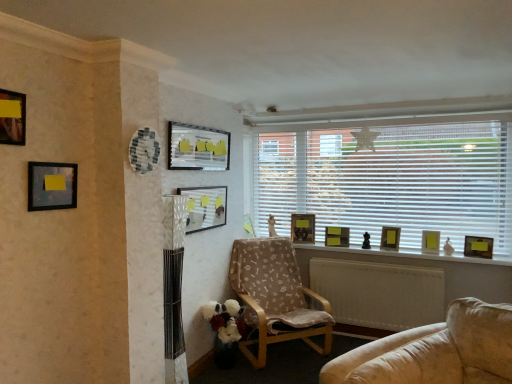
Image resolution: width=512 pixels, height=384 pixels. What are the coordinates of `yellow matte picture frame at right, the 6th picture frame from the front` in the screenshot? It's located at (430, 241).

How much space does yellow matte picture frame at right, positioned as the 8th picture frame in left-to-right order, occupy vertically?

9.43 inches.

In order to face wooden photo frame at center, which is the first picture frame in back-to-front order, should I rotate leftwards or rightwards?

You should look right and rotate roughly 6.570 degrees.

What do you see at coordinates (390, 237) in the screenshot? I see `yellow matte picture frame at window, which is the 7th picture frame in left-to-right order` at bounding box center [390, 237].

This screenshot has height=384, width=512. What are the coordinates of `matte black picture frame at upper center, which is the third picture frame from left to right` in the screenshot? It's located at (197, 148).

Where is `white blinds at upper right`? white blinds at upper right is located at coordinates (391, 179).

Which point is more forward, [42,172] or [341,229]?

The point [42,172] is closer.

Which is in front, matte black picture frame at upper left, the second picture frame positioned from the left, or matte black picture frame at center, the fourth picture frame when ordered from right to left?

matte black picture frame at upper left, the second picture frame positioned from the left, is closer to the camera.

Can you tell me how much matte black picture frame at upper left, which ranks as the 8th picture frame in back-to-front order, and matte black picture frame at center, the fourth picture frame when ordered from right to left, differ in facing direction?

They differ by 83.9 degrees in their facing directions.

Considering the positions of objects matte black picture frame at upper left, which ranks as the 8th picture frame in back-to-front order, and matte black picture frame at center, which appears as the sixth picture frame when viewed from the left, in the image provided, who is more to the left, matte black picture frame at upper left, which ranks as the 8th picture frame in back-to-front order, or matte black picture frame at center, which appears as the sixth picture frame when viewed from the left,?

matte black picture frame at upper left, which ranks as the 8th picture frame in back-to-front order.

Does wooden window sill at center have a greater height compared to matte black picture frame at center, which is the 8th picture frame in front-to-back order?

No, wooden window sill at center is not taller than matte black picture frame at center, which is the 8th picture frame in front-to-back order.

From the image's perspective, is wooden window sill at center on matte black picture frame at center, the fourth picture frame when ordered from right to left?

No, from the image's perspective, wooden window sill at center is not over matte black picture frame at center, the fourth picture frame when ordered from right to left.

Is the depth of wooden window sill at center greater than that of matte black picture frame at center, positioned as the second picture frame in back-to-front order?

That is False.

Can you tell me how much wooden window sill at center and matte black picture frame at center, the fourth picture frame when ordered from right to left, differ in facing direction?

They differ by 2.14 degrees in their facing directions.

You are a GUI agent. You are given a task and a screenshot of the screen. Output one action in this format:
    pyautogui.click(x=<x>, y=<y>)
    Task: Click on the picture frame below the yellow matte picture frame at right, positioned as the 8th picture frame in left-to-right order (from a real-world perspective)
    
    Given the screenshot: What is the action you would take?
    pyautogui.click(x=478, y=246)

In the scene shown: Considering the relative positions of yellow matte picture frame at right, positioned as the 8th picture frame in left-to-right order, and wooden picture frame at right, which is counted as the fifth picture frame, starting from the back, in the image provided, is yellow matte picture frame at right, positioned as the 8th picture frame in left-to-right order, in front of wooden picture frame at right, which is counted as the fifth picture frame, starting from the back,?

That is False.

How distant is yellow matte picture frame at right, marked as the second picture frame in a right-to-left arrangement, from wooden picture frame at right, arranged as the 1th picture frame when viewed from the right?

yellow matte picture frame at right, marked as the second picture frame in a right-to-left arrangement, is 11.91 inches from wooden picture frame at right, arranged as the 1th picture frame when viewed from the right.

Is white blinds at upper right far from yellow matte picture frame at window, acting as the 7th picture frame starting from the front?

No, white blinds at upper right is in close proximity to yellow matte picture frame at window, acting as the 7th picture frame starting from the front.

From the image's perspective, between white blinds at upper right and yellow matte picture frame at window, which is the 7th picture frame in left-to-right order, which one is located above?

white blinds at upper right appears higher in the image.

Is the depth of white blinds at upper right less than that of yellow matte picture frame at window, acting as the 7th picture frame starting from the front?

Yes.

From a real-world perspective, which is physically above, white blinds at upper right or yellow matte picture frame at window, placed as the 3th picture frame when sorted from right to left?

white blinds at upper right, from a real-world perspective.

From the image's perspective, which one is positioned higher, yellow matte picture frame at window, placed as the 3th picture frame when sorted from right to left, or wooden armchair at center?

yellow matte picture frame at window, placed as the 3th picture frame when sorted from right to left.

Does yellow matte picture frame at window, placed as the 3th picture frame when sorted from right to left, have a smaller size compared to wooden armchair at center?

Correct, yellow matte picture frame at window, placed as the 3th picture frame when sorted from right to left, occupies less space than wooden armchair at center.

Looking at this image, which is in front, yellow matte picture frame at window, acting as the 7th picture frame starting from the front, or wooden armchair at center?

wooden armchair at center is more forward.

Is yellow matte picture frame at window, which is the 7th picture frame in left-to-right order, facing away from wooden armchair at center?

No, wooden armchair at center is not at the back of yellow matte picture frame at window, which is the 7th picture frame in left-to-right order.

From their relative heights in the image, would you say matte glass picture frame at center, the 6th picture frame in the back-to-front sequence, is taller or shorter than matte black picture frame at upper left, placed as the 1th picture frame when sorted from left to right?

Considering their sizes, matte glass picture frame at center, the 6th picture frame in the back-to-front sequence, has more height than matte black picture frame at upper left, placed as the 1th picture frame when sorted from left to right.

Starting from the matte glass picture frame at center, the 4th picture frame viewed from the left, which picture frame is the 3rd one in front? Please provide its 2D coordinates.

[(12, 118)]

Is matte glass picture frame at center, the 6th picture frame in the back-to-front sequence, oriented away from matte black picture frame at upper left, marked as the ninth picture frame in a right-to-left arrangement?

No, matte glass picture frame at center, the 6th picture frame in the back-to-front sequence,'s orientation is not away from matte black picture frame at upper left, marked as the ninth picture frame in a right-to-left arrangement.

Does point (195, 215) appear closer or farther from the camera than point (16, 141)?

Clearly, point (195, 215) is more distant from the camera than point (16, 141).

Considering the points (38, 172) and (200, 187), which point is in front, point (38, 172) or point (200, 187)?

Point (38, 172)

Is matte black picture frame at upper left, which ranks as the 8th picture frame in back-to-front order, facing towards matte glass picture frame at center, the 4th picture frame viewed from the left?

No.

How different are the orientations of matte black picture frame at upper left, which ranks as the 8th picture frame in back-to-front order, and matte glass picture frame at center, the 4th picture frame viewed from the left, in degrees?

4.4 degrees.

From the picture: Is matte black picture frame at upper left, positioned as the second picture frame in front-to-back order, to the right of matte glass picture frame at center, arranged as the 4th picture frame when viewed from the front, from the viewer's perspective?

Incorrect, matte black picture frame at upper left, positioned as the second picture frame in front-to-back order, is not on the right side of matte glass picture frame at center, arranged as the 4th picture frame when viewed from the front.

From the image's perspective, count 4th picture frames downward from the matte black picture frame at upper left, the second picture frame positioned from the left, and point to it. Please provide its 2D coordinates.

[(337, 236)]

Identify the location of window sill in front of the matte black picture frame at center, which appears as the sixth picture frame when viewed from the left. (404, 254).

Which object lies further to the anchor point wooden window sill at center, yellow matte picture frame at window, acting as the 7th picture frame starting from the front, or wooden armchair at center?

wooden armchair at center.

From the image, which object appears to be farther from yellow matte picture frame at window, acting as the 7th picture frame starting from the front, matte black picture frame at upper left, placed as the ninth picture frame when sorted from back to front, or matte black picture frame at upper center, which is the third picture frame from left to right?

matte black picture frame at upper left, placed as the ninth picture frame when sorted from back to front, is positioned further to the anchor yellow matte picture frame at window, acting as the 7th picture frame starting from the front.

Which object lies nearer to the anchor point matte black picture frame at upper left, which ranks as the 8th picture frame in back-to-front order, wooden photo frame at center, which is the first picture frame in back-to-front order, or matte glass picture frame at center, arranged as the 4th picture frame when viewed from the front?

matte glass picture frame at center, arranged as the 4th picture frame when viewed from the front, lies closer to matte black picture frame at upper left, which ranks as the 8th picture frame in back-to-front order, than the other object.

When comparing their distances from wooden window sill at center, does matte black picture frame at upper left, placed as the 1th picture frame when sorted from left to right, or matte black picture frame at center, positioned as the second picture frame in back-to-front order, seem closer?

The object closer to wooden window sill at center is matte black picture frame at center, positioned as the second picture frame in back-to-front order.

From the image, which object appears to be farther from yellow matte picture frame at right, the 6th picture frame from the front, matte black picture frame at center, positioned as the second picture frame in back-to-front order, or matte glass picture frame at center, the 4th picture frame viewed from the left?

matte glass picture frame at center, the 4th picture frame viewed from the left.

From the picture: Considering their positions, is wooden picture frame at right, arranged as the 1th picture frame when viewed from the right, positioned further to yellow matte picture frame at window, acting as the 7th picture frame starting from the front, than wooden photo frame at center, which is the first picture frame in back-to-front order?

wooden photo frame at center, which is the first picture frame in back-to-front order, lies further to yellow matte picture frame at window, acting as the 7th picture frame starting from the front, than the other object.

When comparing their distances from matte black picture frame at upper left, placed as the 1th picture frame when sorted from left to right, does matte black picture frame at upper left, positioned as the second picture frame in front-to-back order, or wooden window sill at center seem further?

Among the two, wooden window sill at center is located further to matte black picture frame at upper left, placed as the 1th picture frame when sorted from left to right.

Based on the photo, based on their spatial positions, is matte black picture frame at upper center, which ranks as the 7th picture frame in right-to-left order, or wooden picture frame at right, the fifth picture frame positioned from the front, closer to yellow matte picture frame at right, positioned as the 8th picture frame in left-to-right order?

wooden picture frame at right, the fifth picture frame positioned from the front, is closer to yellow matte picture frame at right, positioned as the 8th picture frame in left-to-right order.

In order to click on picture frame between matte black picture frame at upper left, placed as the 1th picture frame when sorted from left to right, and matte black picture frame at upper center, arranged as the 7th picture frame when viewed from the back, in the front-back direction in this screenshot , I will do `click(51, 186)`.

Locate an element on the screen. The height and width of the screenshot is (384, 512). chair situated between matte glass picture frame at center, the 6th picture frame in the back-to-front sequence, and yellow matte picture frame at window, which is the 7th picture frame in left-to-right order, from left to right is located at coordinates (276, 297).

Identify the location of window between matte black picture frame at center, the fourth picture frame when ordered from right to left, and wooden picture frame at right, placed as the 9th picture frame when sorted from left to right, from left to right. The width and height of the screenshot is (512, 384). tap(391, 179).

Identify the location of window between matte black picture frame at upper left, which appears as the eighth picture frame when viewed from the right, and wooden picture frame at right, placed as the 9th picture frame when sorted from left to right. This screenshot has height=384, width=512. (391, 179).